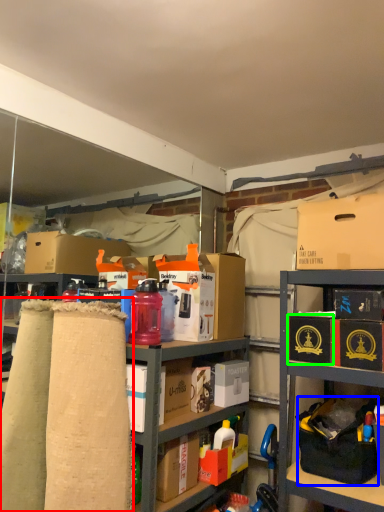
Question: Which is farther away from fabric (highlighted by a red box)? handbag (highlighted by a blue box) or box (highlighted by a green box)?

Choices:
 (A) handbag
 (B) box

Answer: (A)